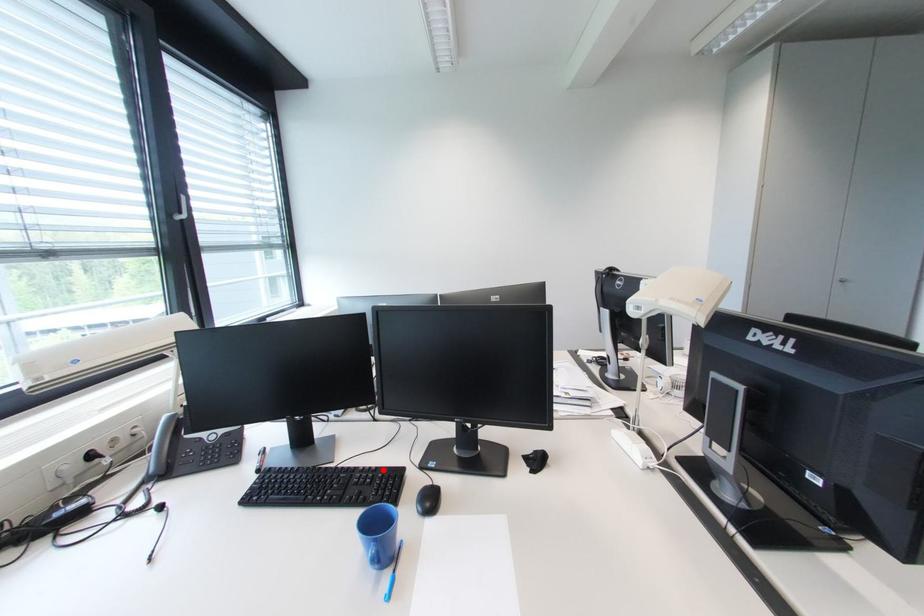
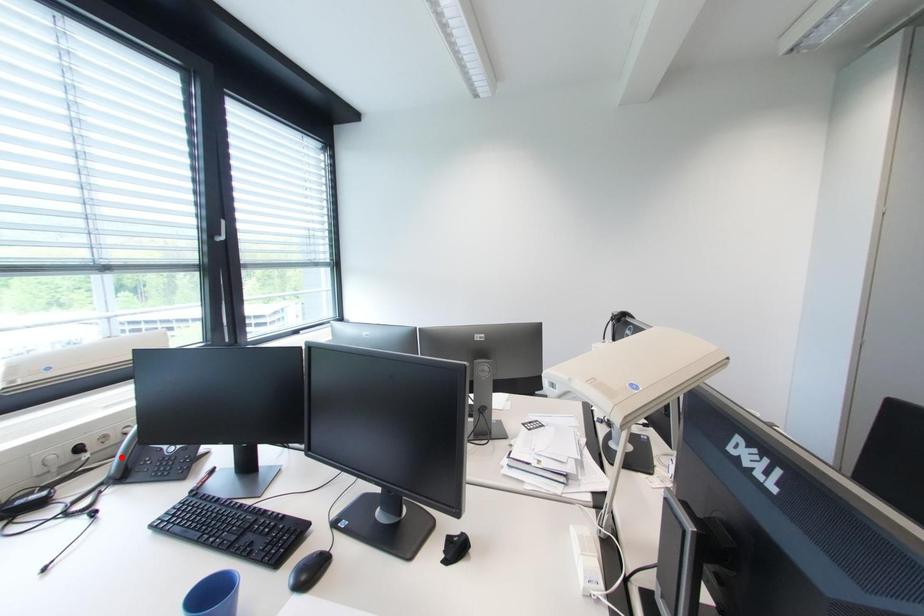
I am providing you with two images of the same scene from different viewpoints. A red point is marked on the first image and another point is marked on the second image. Are the points marked in image1 and image2 representing the same 3D position?

No